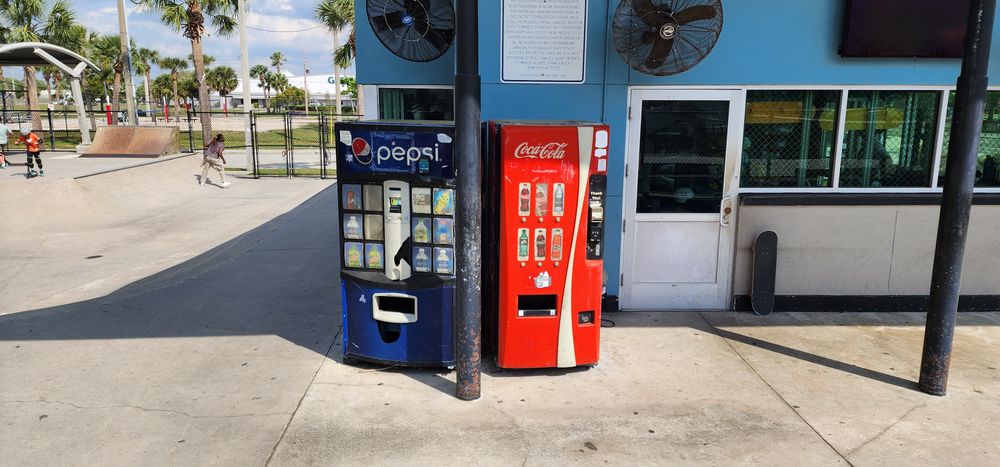
This screenshot has height=467, width=1000. In order to click on window in this screenshot , I will do `click(670, 164)`, `click(789, 141)`, `click(989, 161)`, `click(900, 137)`, `click(425, 99)`.